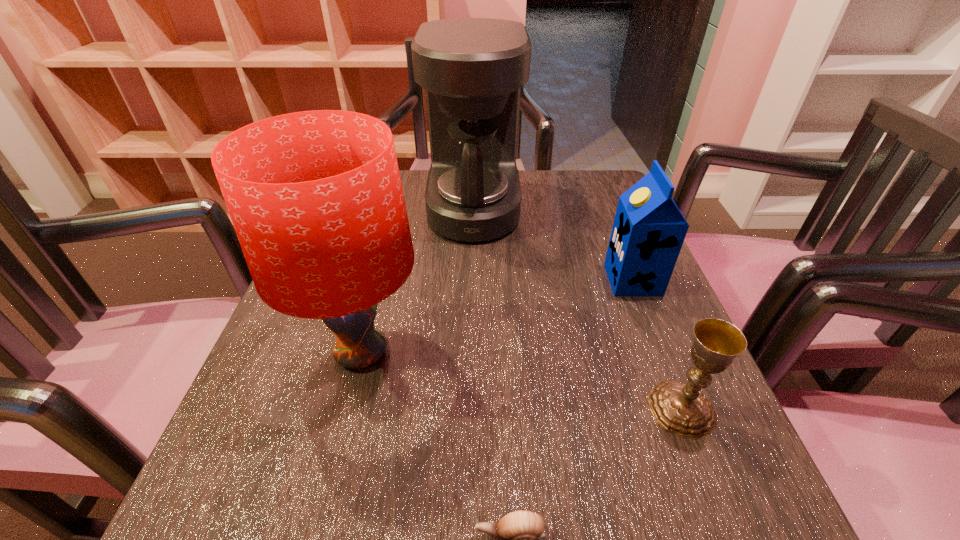
Where is `free point between the chalice and the carton`? The height and width of the screenshot is (540, 960). free point between the chalice and the carton is located at coordinates (657, 345).

At what (x,y) coordinates should I click in order to perform the action: click on free spot between the third shortest object and the chalice. Please return your answer as a coordinate pair (x, y). This screenshot has height=540, width=960. Looking at the image, I should click on (657, 345).

In order to click on free space between the chalice and the lampshade in this screenshot , I will do `click(521, 381)`.

Image resolution: width=960 pixels, height=540 pixels. What are the coordinates of `object that ranks as the third closest to the escargot` in the screenshot? It's located at (648, 232).

At what (x,y) coordinates should I click in order to perform the action: click on the fourth closest object to the third shortest object. Please return your answer as a coordinate pair (x, y). Image resolution: width=960 pixels, height=540 pixels. Looking at the image, I should click on (514, 537).